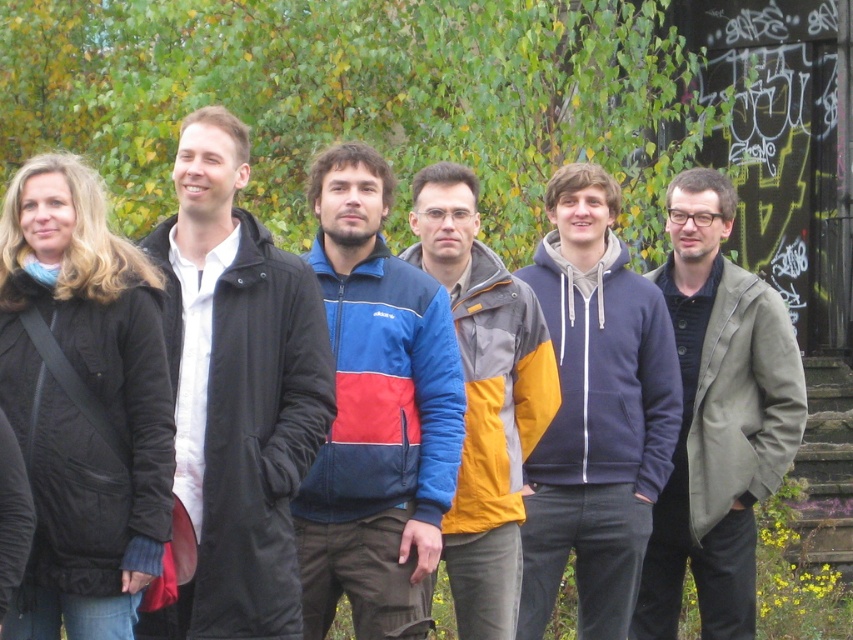
Who is higher up, blue and red nylon jacket at center or matte gray coat at right?

blue and red nylon jacket at center is above.

The image size is (853, 640). I want to click on blue and red nylon jacket at center, so click(x=376, y=413).

Find the location of a particular element. blue and red nylon jacket at center is located at coordinates (376, 413).

Does black matte jacket at left have a greater width compared to navy blue hoodie at center?

Yes, black matte jacket at left is wider than navy blue hoodie at center.

Does black matte jacket at left appear on the right side of navy blue hoodie at center?

In fact, black matte jacket at left is to the left of navy blue hoodie at center.

At what (x,y) coordinates should I click in order to perform the action: click on black matte jacket at left. Please return your answer as a coordinate pair (x, y). Looking at the image, I should click on (82, 403).

Between point (19, 301) and point (746, 440), which one is positioned behind?

Positioned behind is point (746, 440).

Identify the location of black matte jacket at left. The image size is (853, 640). point(82,403).